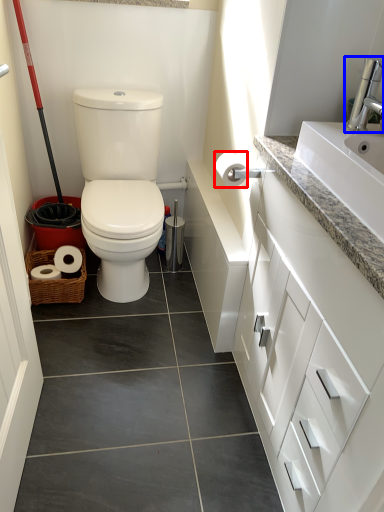
Question: Which object appears farthest to the camera in this image, toilet paper (highlighted by a red box) or faucet (highlighted by a blue box)?

Choices:
 (A) toilet paper
 (B) faucet

Answer: (A)